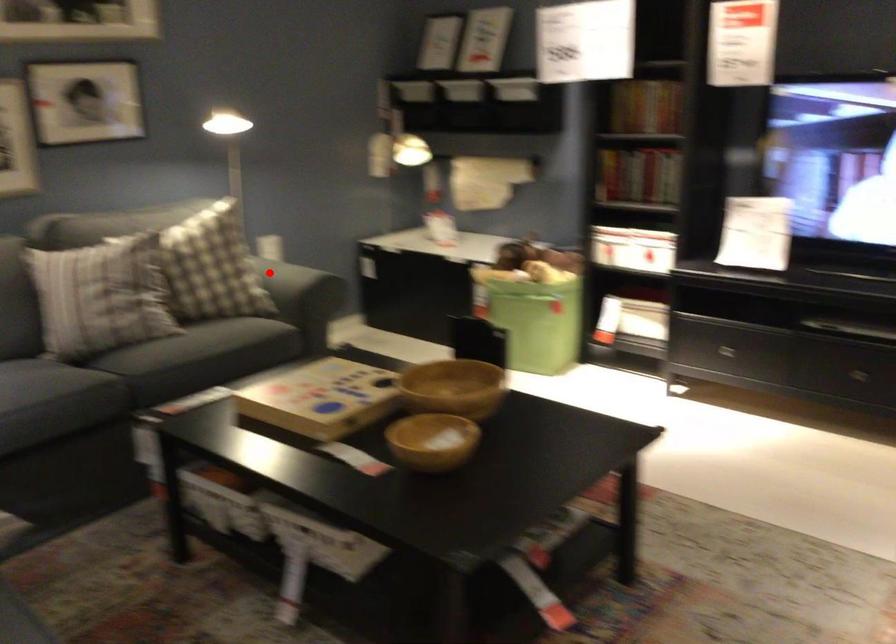
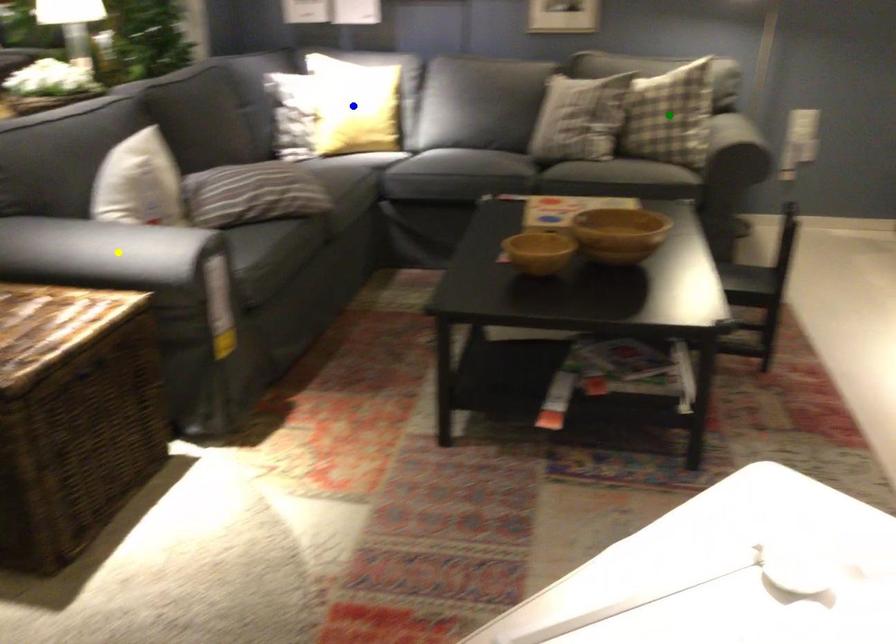
Question: I am providing you with two images of the same scene from different viewpoints. A red point is marked on the first image. You are given multiple points on the second image. Which point in image 2 represents the same 3d spot as the red point in image 1?

Choices:
 (A) green point
 (B) blue point
 (C) yellow point

Answer: (A)